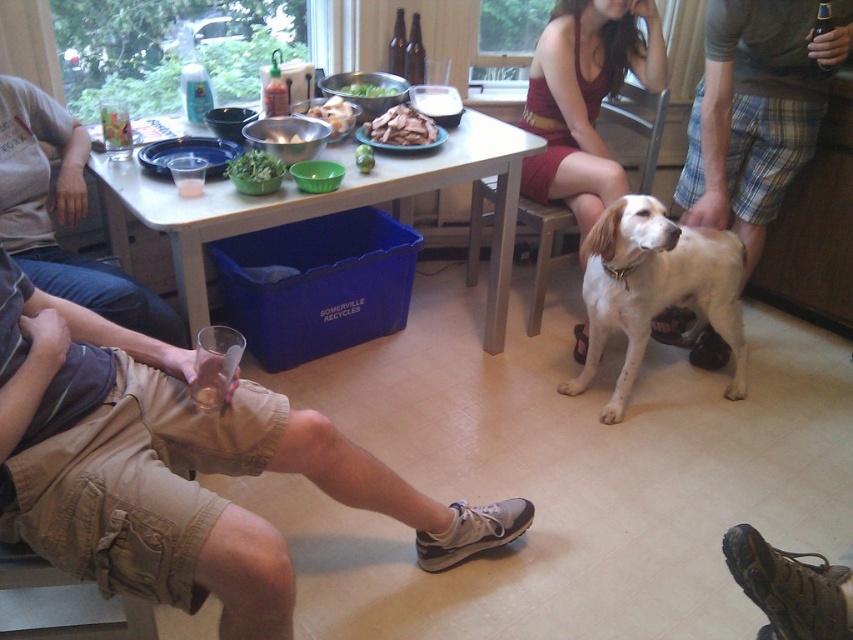
Question: Which object is closer to the camera taking this photo?

Choices:
 (A) green leafy vegetables at center
 (B) white fur dog at center
 (C) white plastic table at center

Answer: (C)

Question: Does light brown cotton shorts at lower left have a greater width compared to white matte mushrooms at center?

Choices:
 (A) no
 (B) yes

Answer: (B)

Question: Among these points, which one is farthest from the camera?

Choices:
 (A) (305, 132)
 (B) (223, 228)
 (C) (737, 257)
 (D) (415, 109)

Answer: (D)

Question: Which point is farther from the camera taking this photo?

Choices:
 (A) (1, 141)
 (B) (257, 168)
 (C) (584, 193)
 (D) (119, 465)

Answer: (C)

Question: Does tan cotton shorts at lower left have a lesser width compared to green leafy vegetable at center?

Choices:
 (A) yes
 (B) no

Answer: (B)

Question: Is maroon fabric dress at center closer to camera compared to brown matte mushrooms at center?

Choices:
 (A) yes
 (B) no

Answer: (B)